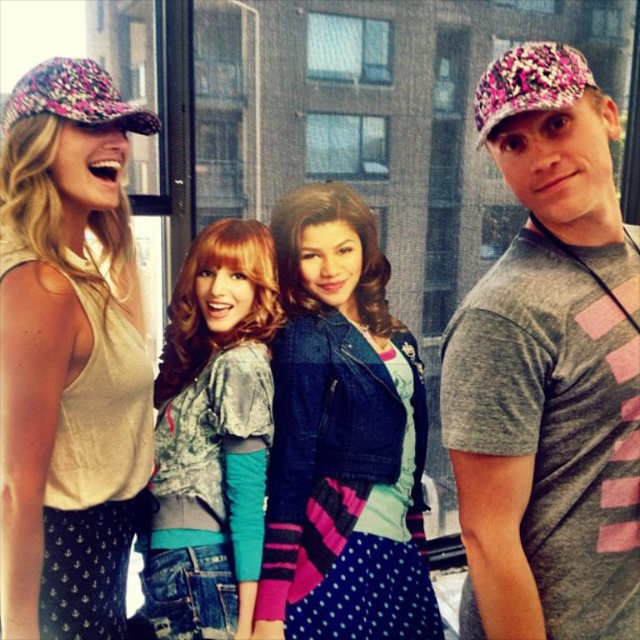
Question: Can you confirm if denim jacket at center is positioned below distressed denim jacket at center?

Choices:
 (A) no
 (B) yes

Answer: (A)

Question: Which of the following is the farthest from the observer?

Choices:
 (A) (305, 412)
 (B) (28, 257)
 (C) (600, 177)
 (D) (246, 300)

Answer: (D)

Question: Which object is the farthest from the distressed denim jacket at center?

Choices:
 (A) denim jacket at center
 (B) gray cotton t-shirt at right

Answer: (B)

Question: Which of the following is the farthest from the observer?

Choices:
 (A) gray cotton t-shirt at right
 (B) distressed denim jacket at center
 (C) denim jacket at center

Answer: (C)

Question: Does gray cotton t-shirt at right have a lesser width compared to denim jacket at center?

Choices:
 (A) yes
 (B) no

Answer: (A)

Question: Can you confirm if gray cotton t-shirt at right is wider than distressed denim jacket at center?

Choices:
 (A) yes
 (B) no

Answer: (A)